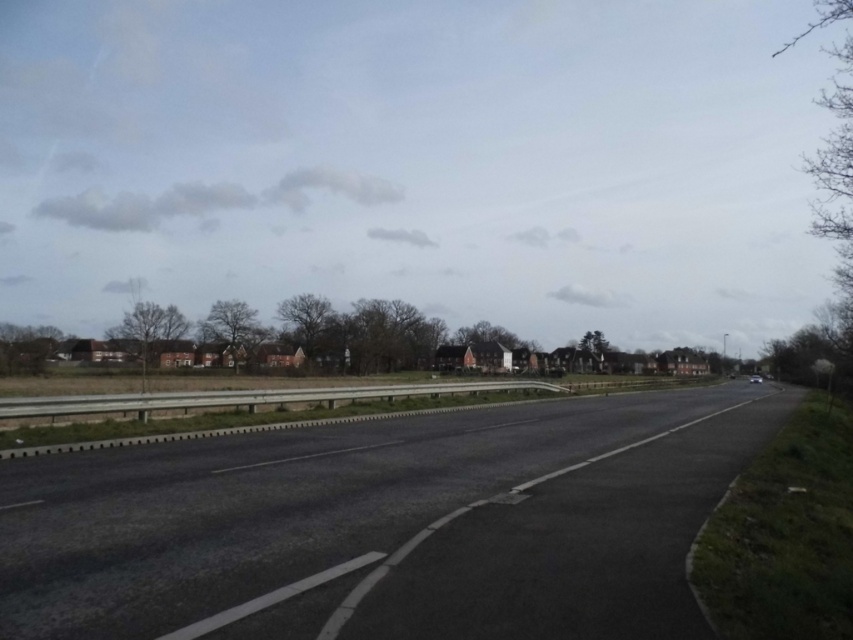
Between point (7, 584) and point (294, 392), which one is positioned in front?

Point (7, 584) is more forward.

Which is more to the right, asphalt road at center or smooth concrete barrier at center?

asphalt road at center

Is point (225, 582) positioned in front of point (322, 404)?

Yes.

Where is `asphalt road at center`? asphalt road at center is located at coordinates (386, 525).